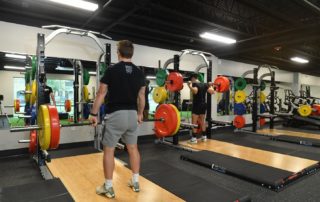
Where is `brown floor`? Image resolution: width=320 pixels, height=202 pixels. brown floor is located at coordinates point(255,152), point(80,171).